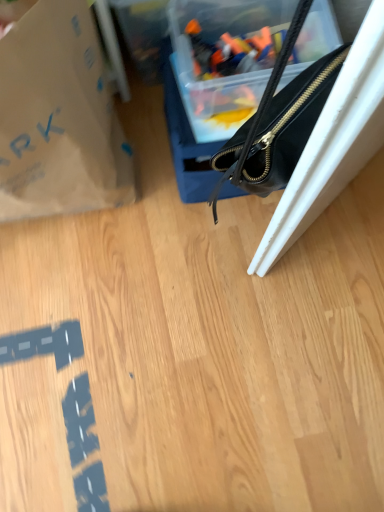
Identify the location of blank space above black leather handbag at upper right (from a real-world perspective). (233, 68).